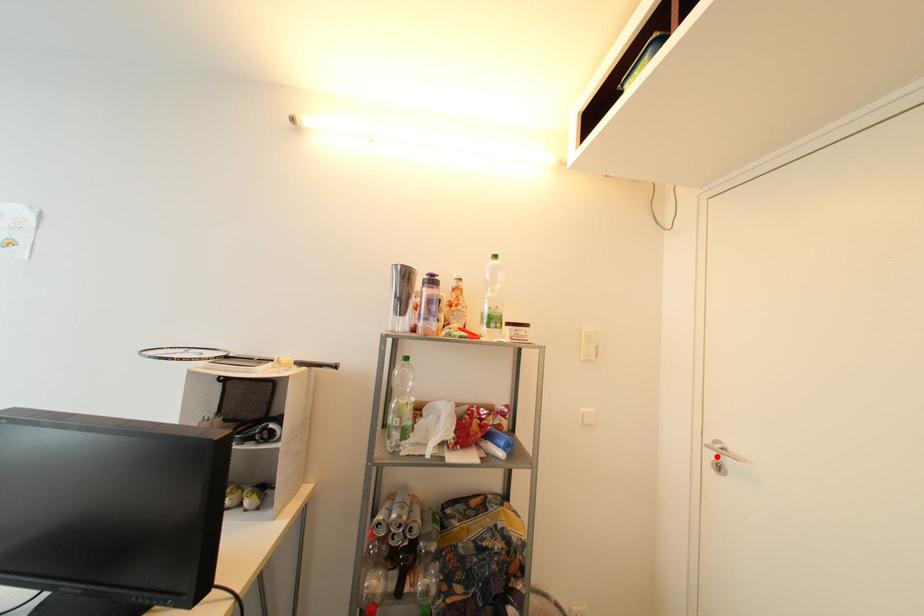
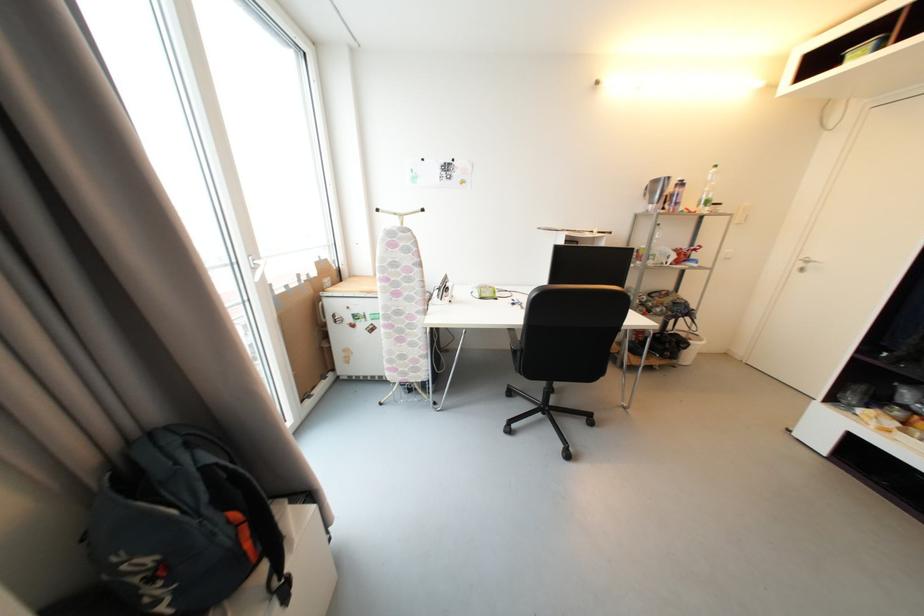
Locate, in the second image, the point that corresponds to the highlighted location in the first image.

(806, 267)